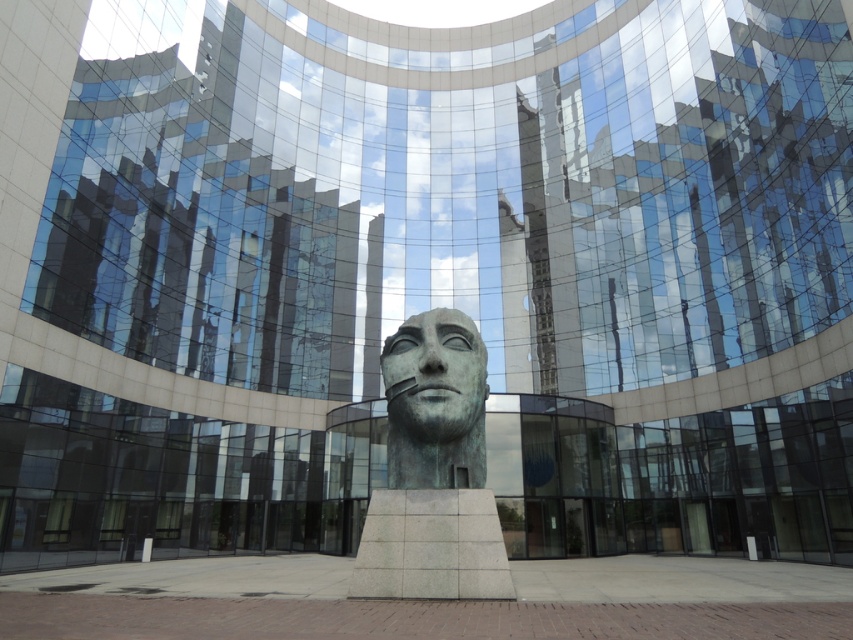
Question: Does green patina bronze head at center appear on the right side of bronze statue at center?

Choices:
 (A) yes
 (B) no

Answer: (B)

Question: Does green patina bronze head at center have a larger size compared to bronze statue at center?

Choices:
 (A) yes
 (B) no

Answer: (A)

Question: Which point is closer to the camera?

Choices:
 (A) (379, 570)
 (B) (480, 422)

Answer: (A)

Question: Can you confirm if green patina bronze head at center is smaller than bronze statue at center?

Choices:
 (A) yes
 (B) no

Answer: (B)